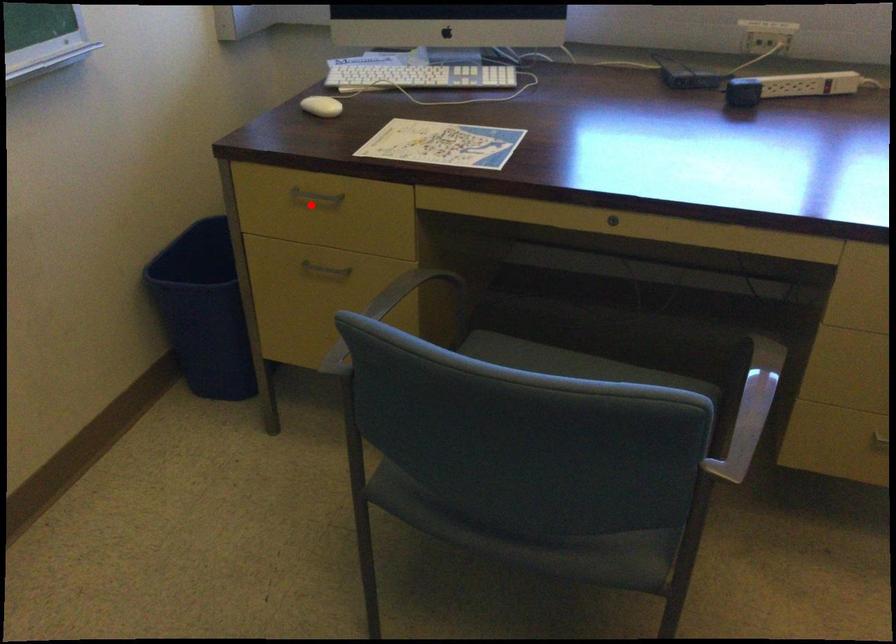
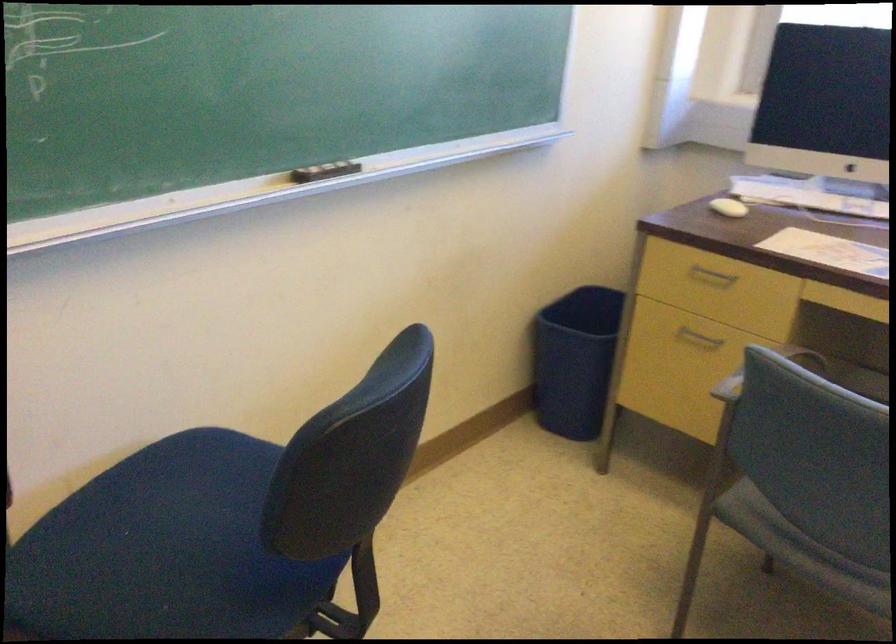
Question: I am providing you with two images of the same scene from different viewpoints. A red point is shown in image1. For the corresponding object point in image2, is it positioned nearer or farther from the camera?

Choices:
 (A) Nearer
 (B) Farther

Answer: (B)